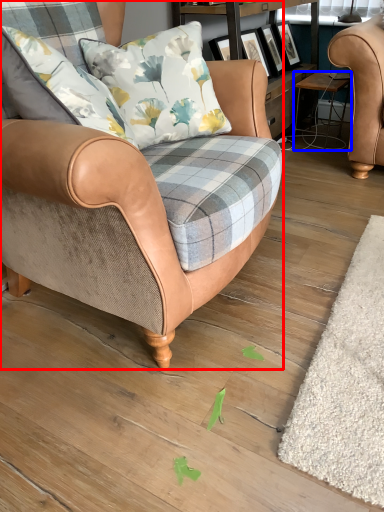
Question: Which object appears closest to the camera in this image, chair (highlighted by a red box) or stool (highlighted by a blue box)?

Choices:
 (A) chair
 (B) stool

Answer: (A)